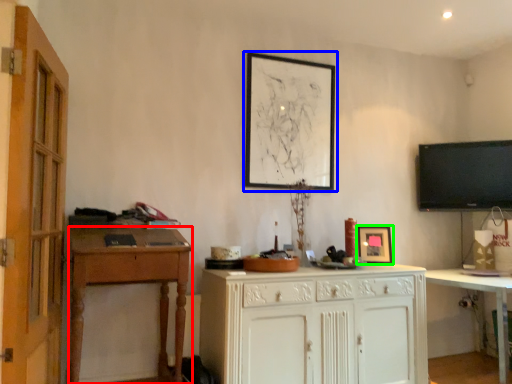
Question: Based on their relative distances, which object is farther from desk (highlighted by a red box)? Choose from picture frame (highlighted by a blue box) and picture frame (highlighted by a green box).

Choices:
 (A) picture frame
 (B) picture frame

Answer: (B)